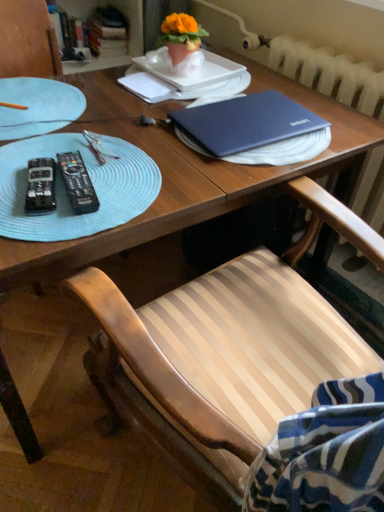
At what (x,y) coordinates should I click in order to perform the action: click on free space between orange matte flower pot at upper center and black plastic remote control at left, which is counted as the second remote control, starting from the left. Please return your answer as a coordinate pair (x, y). The image size is (384, 512). Looking at the image, I should click on (130, 130).